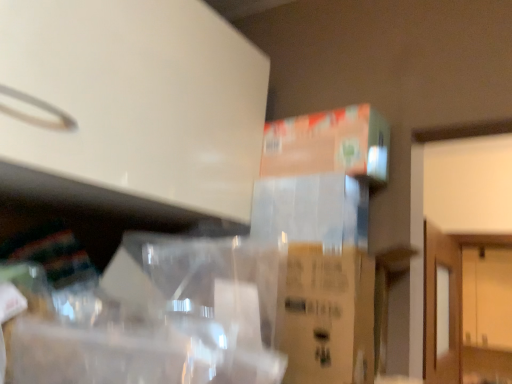
Question: Could wooden cabinet at right be considered to be inside orange cardboard box at upper right?

Choices:
 (A) yes
 (B) no

Answer: (B)

Question: From the image's perspective, is orange cardboard box at upper right above wooden cabinet at right?

Choices:
 (A) yes
 (B) no

Answer: (A)

Question: Is orange cardboard box at upper right thinner than wooden cabinet at right?

Choices:
 (A) no
 (B) yes

Answer: (B)

Question: Can you confirm if orange cardboard box at upper right is shorter than wooden cabinet at right?

Choices:
 (A) yes
 (B) no

Answer: (A)

Question: Is orange cardboard box at upper right further to camera compared to wooden cabinet at right?

Choices:
 (A) no
 (B) yes

Answer: (A)

Question: Can you confirm if orange cardboard box at upper right is taller than wooden cabinet at right?

Choices:
 (A) no
 (B) yes

Answer: (A)

Question: From the image's perspective, would you say wooden cabinet at right is positioned over orange cardboard box at upper right?

Choices:
 (A) yes
 (B) no

Answer: (B)

Question: Is wooden cabinet at right smaller than orange cardboard box at upper right?

Choices:
 (A) no
 (B) yes

Answer: (A)

Question: Is wooden cabinet at right bigger than orange cardboard box at upper right?

Choices:
 (A) no
 (B) yes

Answer: (B)

Question: Is wooden cabinet at right aimed at orange cardboard box at upper right?

Choices:
 (A) no
 (B) yes

Answer: (B)

Question: Are wooden cabinet at right and orange cardboard box at upper right located far from each other?

Choices:
 (A) yes
 (B) no

Answer: (A)

Question: Does wooden cabinet at right have a greater height compared to orange cardboard box at upper right?

Choices:
 (A) no
 (B) yes

Answer: (B)

Question: Is wooden cabinet at right wider or thinner than orange cardboard box at upper right?

Choices:
 (A) thin
 (B) wide

Answer: (B)